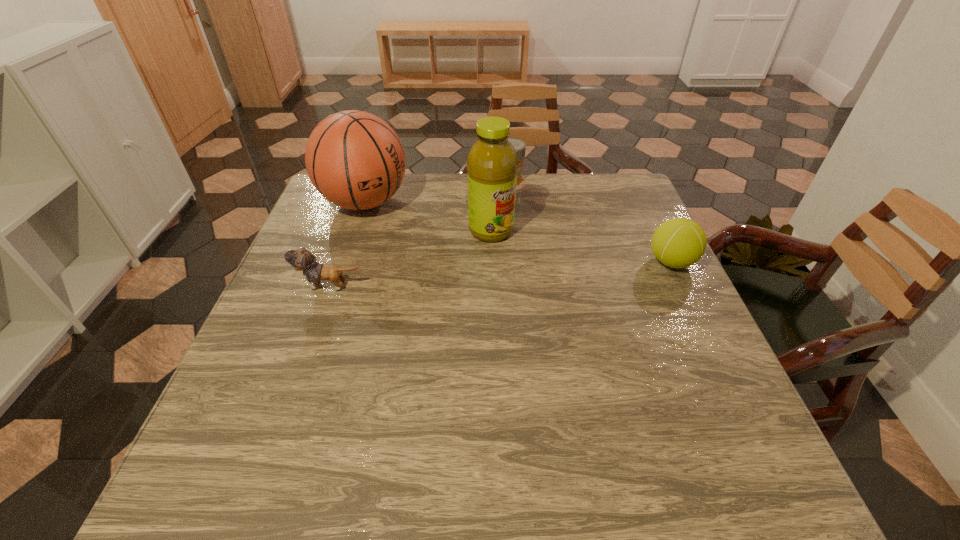
Identify the location of free space on the desktop that is between the kitten and the tennis ball and is positioned on the front label of the fruit juice. (541, 271).

This screenshot has width=960, height=540. In order to click on vacant space on the desktop that is between the kitten and the rightmost object and is positioned on the surface of the basketball near the brand logo in this screenshot , I will do (492, 274).

In order to click on vacant space on the desktop that is between the kitten and the tennis ball and is positioned on the label side of the medicine in this screenshot , I will do `click(527, 272)`.